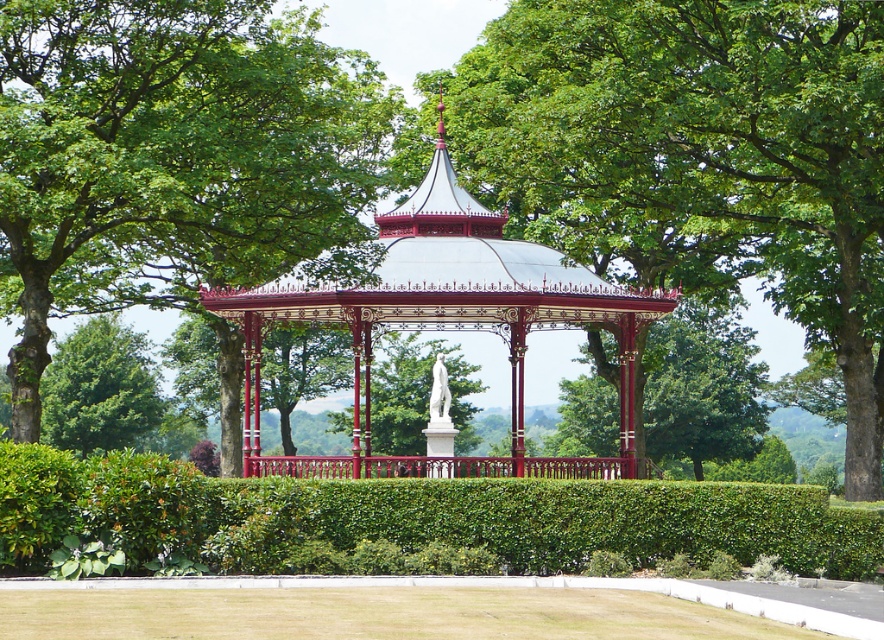
Is green leafy tree at center positioned before metallic gazebo at center?

Yes, it is.

Is green leafy tree at center to the left of metallic gazebo at center from the viewer's perspective?

No, green leafy tree at center is not to the left of metallic gazebo at center.

Which is behind, point (841, 260) or point (291, 298)?

The point (841, 260) is behind.

Identify the location of green leafy tree at center. (698, 157).

Can you confirm if green leafy tree at upper center is bigger than green leafy hedge at center?

Yes.

Which of these two, green leafy tree at upper center or green leafy hedge at center, stands taller?

green leafy tree at upper center is taller.

The height and width of the screenshot is (640, 884). I want to click on green leafy tree at upper center, so click(x=173, y=160).

Is green leafy tree at center smaller than green leafy hedge at center?

Incorrect, green leafy tree at center is not smaller in size than green leafy hedge at center.

Who is more forward, (x=863, y=429) or (x=237, y=518)?

Point (x=237, y=518)

This screenshot has width=884, height=640. Describe the element at coordinates (698, 157) in the screenshot. I see `green leafy tree at center` at that location.

Find the location of a particular element. green leafy tree at center is located at coordinates (698, 157).